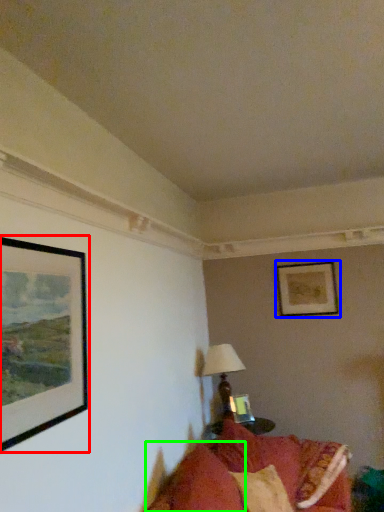
Question: Estimate the real-world distances between objects in this image. Which object is farther from picture frame (highlighted by a red box), picture frame (highlighted by a blue box) or pillow (highlighted by a green box)?

Choices:
 (A) picture frame
 (B) pillow

Answer: (A)